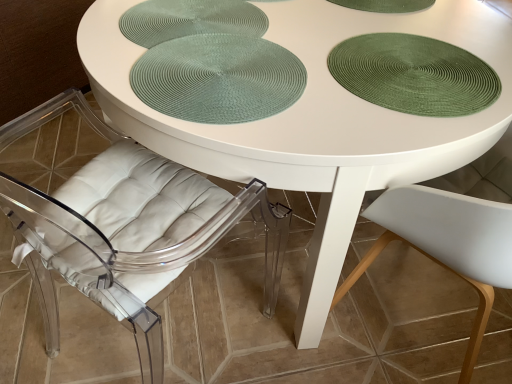
Question: Which direction should I rotate to face green woven placemat at upper center, which ranks as the 2th glass plate in right-to-left order, — up or down?

Choices:
 (A) down
 (B) up

Answer: (B)

Question: Should I look upward or downward to see green woven placemat at center?

Choices:
 (A) up
 (B) down

Answer: (A)

Question: From a real-world perspective, is green woven placemat at center physically above transparent acrylic chair at lower left?

Choices:
 (A) no
 (B) yes

Answer: (B)

Question: Are green woven placemat at center and transparent acrylic chair at lower left beside each other?

Choices:
 (A) no
 (B) yes

Answer: (A)

Question: Can you confirm if green woven placemat at center is smaller than transparent acrylic chair at lower left?

Choices:
 (A) yes
 (B) no

Answer: (A)

Question: Does green woven placemat at center have a larger size compared to transparent acrylic chair at lower left?

Choices:
 (A) yes
 (B) no

Answer: (B)

Question: Is green woven placemat at center taller than transparent acrylic chair at lower left?

Choices:
 (A) no
 (B) yes

Answer: (A)

Question: Can transparent acrylic chair at lower left be found inside green woven placemat at center?

Choices:
 (A) no
 (B) yes

Answer: (A)

Question: From the image's perspective, would you say transparent acrylic chair at lower left is shown under green woven placemat at center?

Choices:
 (A) no
 (B) yes

Answer: (B)

Question: Can you see transparent acrylic chair at lower left touching green woven placemat at center?

Choices:
 (A) no
 (B) yes

Answer: (A)

Question: From a real-world perspective, is transparent acrylic chair at lower left positioned over green woven placemat at center based on gravity?

Choices:
 (A) yes
 (B) no

Answer: (B)

Question: Is green woven placemat at center inside transparent acrylic chair at lower left?

Choices:
 (A) no
 (B) yes

Answer: (B)

Question: Considering the relative sizes of transparent acrylic chair at lower left and green woven placemat at center in the image provided, is transparent acrylic chair at lower left wider than green woven placemat at center?

Choices:
 (A) no
 (B) yes

Answer: (B)

Question: Are transparent acrylic chair at lower left and green woven placemat at center located far from each other?

Choices:
 (A) no
 (B) yes

Answer: (B)

Question: Can transparent acrylic chair at lower left be found inside green textured placemat at upper right, positioned as the 2th glass plate in left-to-right order?

Choices:
 (A) yes
 (B) no

Answer: (B)